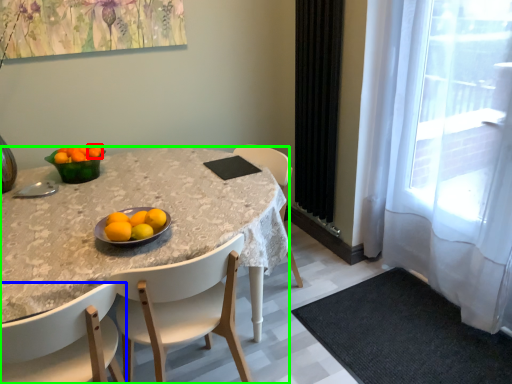
Question: Considering the real-world distances, which object is closest to tangerine (highlighted by a red box)? chair (highlighted by a blue box) or desk (highlighted by a green box).

Choices:
 (A) chair
 (B) desk

Answer: (B)